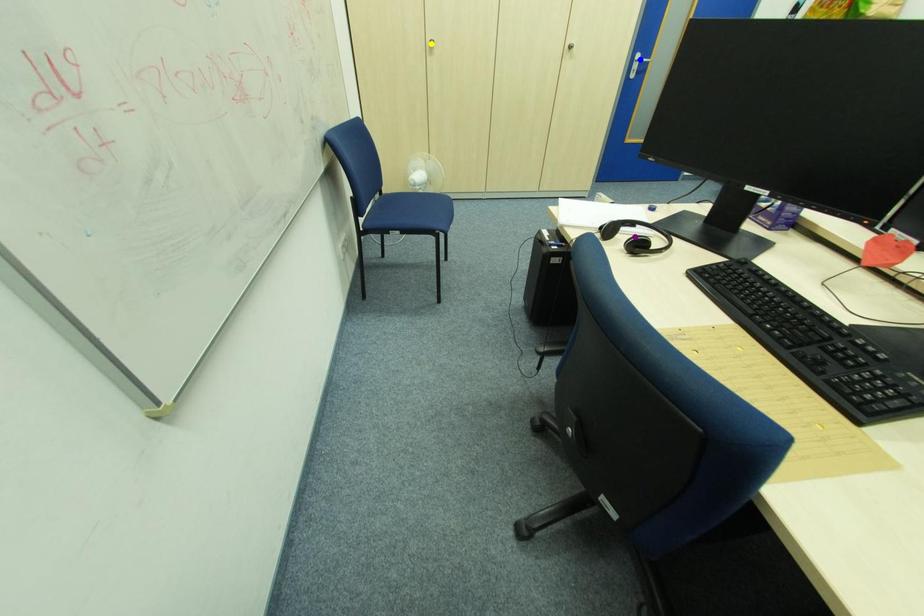
Order these from nearest to farthest:
purple point
yellow point
blue point

1. purple point
2. yellow point
3. blue point